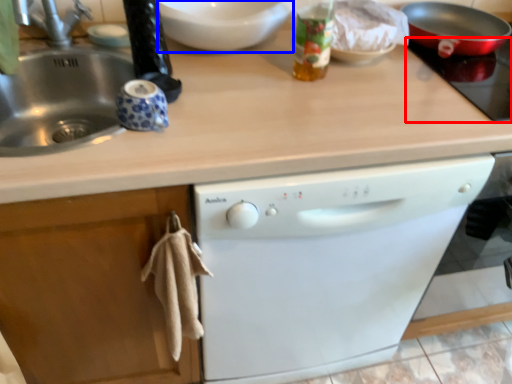
Question: Which of the following is the closest to the observer, gas stove (highlighted by a red box) or mixing bowl (highlighted by a blue box)?

Choices:
 (A) gas stove
 (B) mixing bowl

Answer: (A)